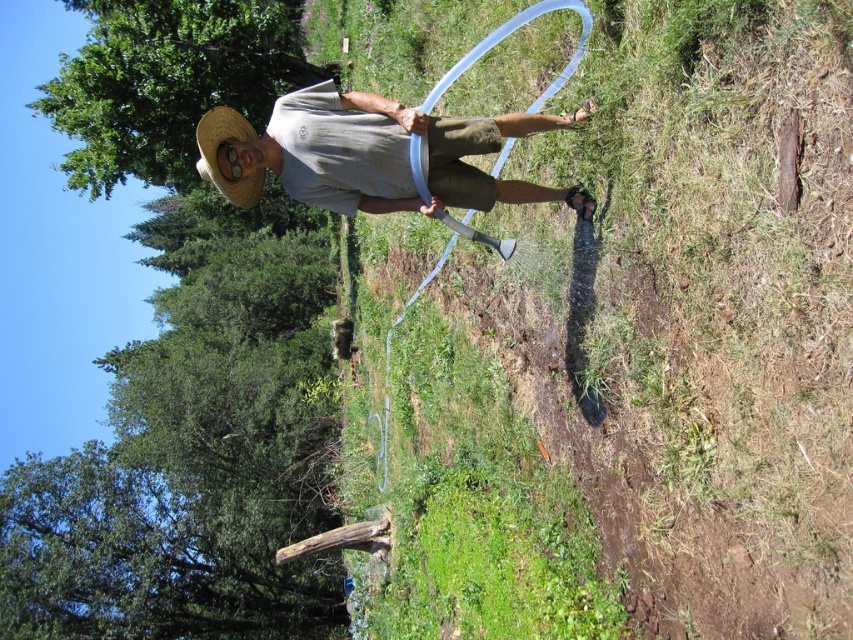
Question: Is translucent plastic hose at center further to the viewer compared to straw hat at center?

Choices:
 (A) yes
 (B) no

Answer: (B)

Question: Is matte straw hat at center to the right of straw hat at center from the viewer's perspective?

Choices:
 (A) yes
 (B) no

Answer: (A)

Question: Among these objects, which one is farthest from the camera?

Choices:
 (A) straw hat at center
 (B) translucent plastic hose at center

Answer: (A)

Question: Is translucent plastic hose at center thinner than straw hat at center?

Choices:
 (A) yes
 (B) no

Answer: (B)

Question: Which object is closer to the camera taking this photo?

Choices:
 (A) translucent plastic hose at center
 (B) matte straw hat at center

Answer: (A)

Question: Among these points, which one is nearest to the camera?

Choices:
 (A) (210, 118)
 (B) (566, 595)

Answer: (A)